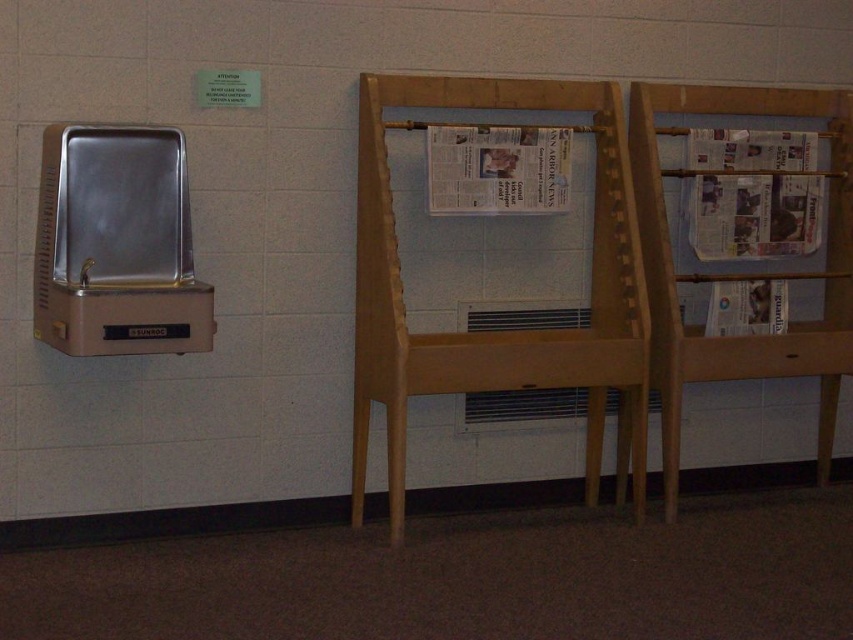
You are a delivery person who needs to place a new stack of newspapers in the light brown wooden newspaper rack at center. However, the white glossy newspaper at center is already occupying space. Can you fit the new stack into the rack without removing the existing newspaper?

The light brown wooden newspaper rack at center is much taller than the white glossy newspaper at center, so yes, you can fit the new stack into the rack without removing the existing newspaper.

From the picture: You are organizing a small library and need to place the light brown wooden newspaper rack at center and the white glossy newspaper at center on a shelf. If the shelf has limited space, which object should you place first to ensure both fit?

You should place the light brown wooden newspaper rack at center first since it has a larger size compared to the white glossy newspaper at center, allowing the smaller newspaper to fit alongside it.